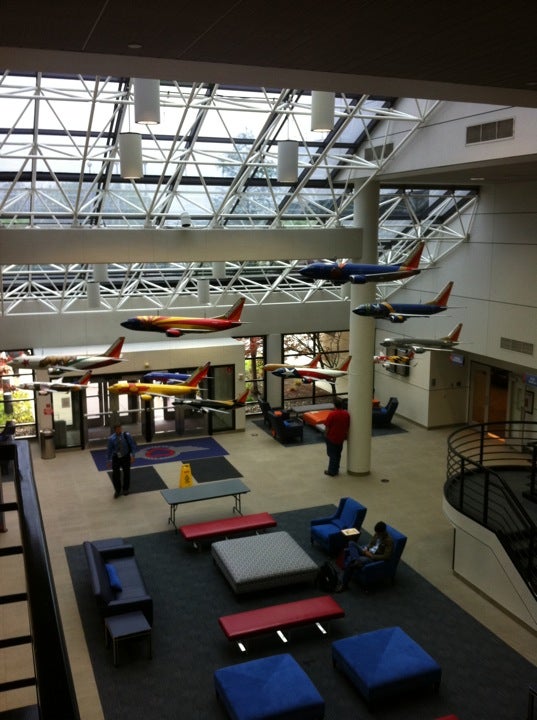
Where is `sofa`? The height and width of the screenshot is (720, 537). sofa is located at coordinates 125,571.